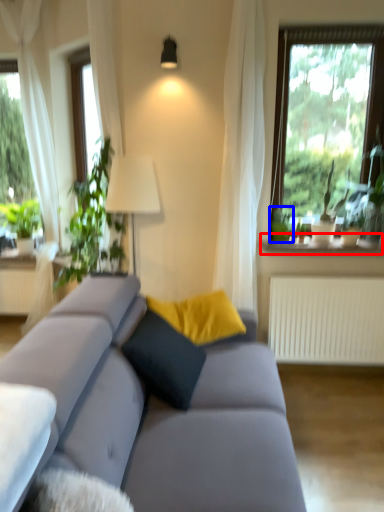
Question: Which point is closer to the camera, window sill (highlighted by a red box) or plant (highlighted by a blue box)?

Choices:
 (A) window sill
 (B) plant

Answer: (A)